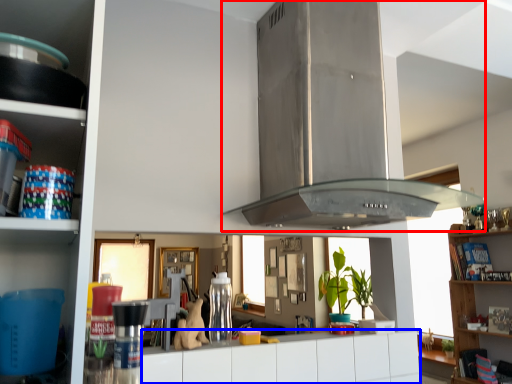
Question: Among these objects, which one is farthest to the camera, exhaust hood (highlighted by a red box) or drawer (highlighted by a blue box)?

Choices:
 (A) exhaust hood
 (B) drawer

Answer: (B)